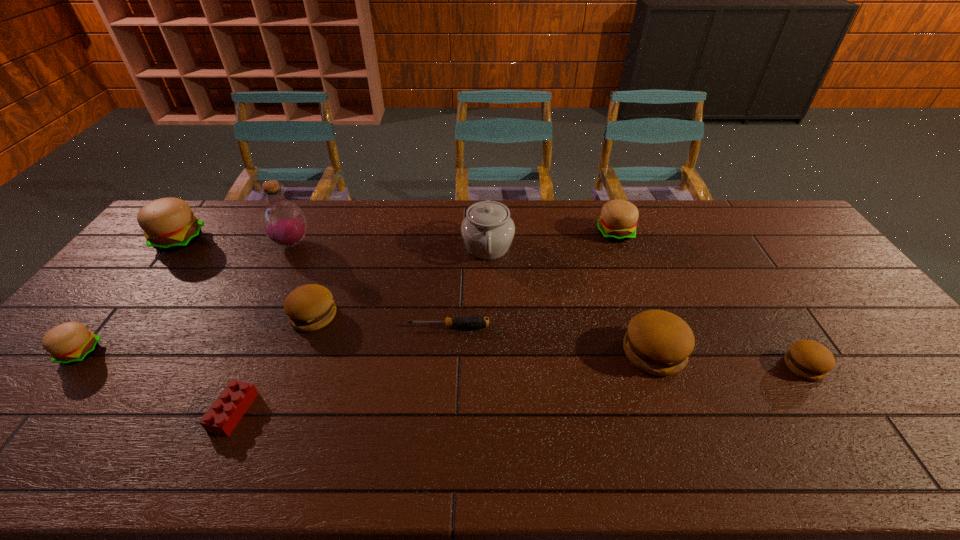
At what (x,y) coordinates should I click in order to perform the action: click on empty location between the second smallest brown hamburger and the second brown hamburger from right to left. Please return your answer as a coordinate pair (x, y). Looking at the image, I should click on (484, 334).

This screenshot has height=540, width=960. What are the coordinates of `free space between the shortest object and the nearest object` in the screenshot? It's located at (341, 369).

Point out which object is positioned as the fifth nearest to the second biggest beige hamburger. Please provide its 2D coordinates. Your answer should be formatted as a tuple, i.e. [(x, y)], where the tuple contains the x and y coordinates of a point satisfying the conditions above.

[(310, 307)]

Identify the location of object identified as the sixth closest to the leftmost brown hamburger. The width and height of the screenshot is (960, 540). (69, 343).

I want to click on hamburger identified as the third closest to the tallest hamburger, so click(x=618, y=220).

I want to click on the second closest hamburger to the screwdriver, so click(x=658, y=342).

Where is `beige hamburger that can be found as the closest to the purple bottle`? The width and height of the screenshot is (960, 540). beige hamburger that can be found as the closest to the purple bottle is located at coordinates (169, 224).

Locate an element on the screen. Image resolution: width=960 pixels, height=540 pixels. beige hamburger that is the second closest one to the biggest beige hamburger is located at coordinates (618, 220).

The image size is (960, 540). Find the location of `brown hamburger that stands as the second closest to the rightmost hamburger`. brown hamburger that stands as the second closest to the rightmost hamburger is located at coordinates (310, 307).

Find the location of a particular element. Image resolution: width=960 pixels, height=540 pixels. the second closest brown hamburger to the leftmost brown hamburger is located at coordinates (808, 359).